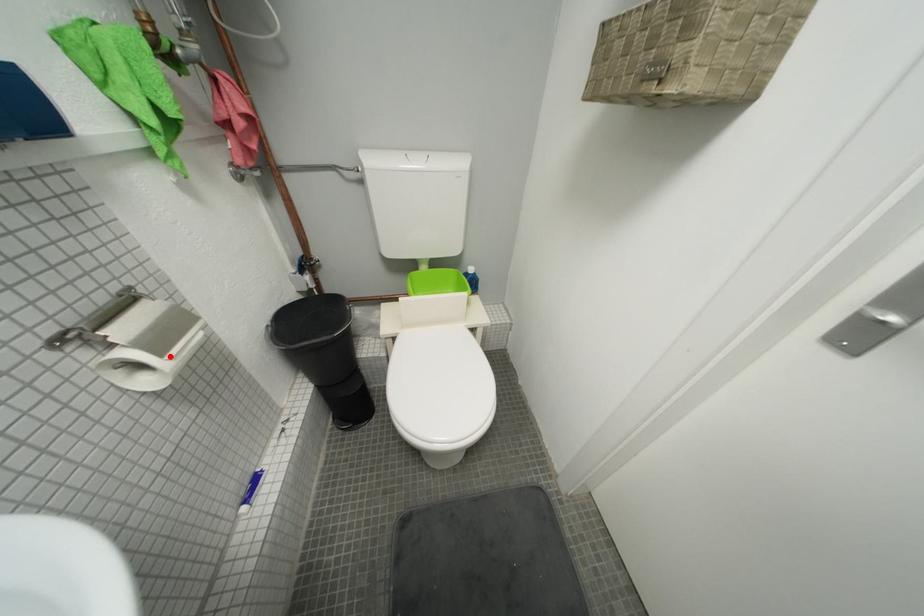
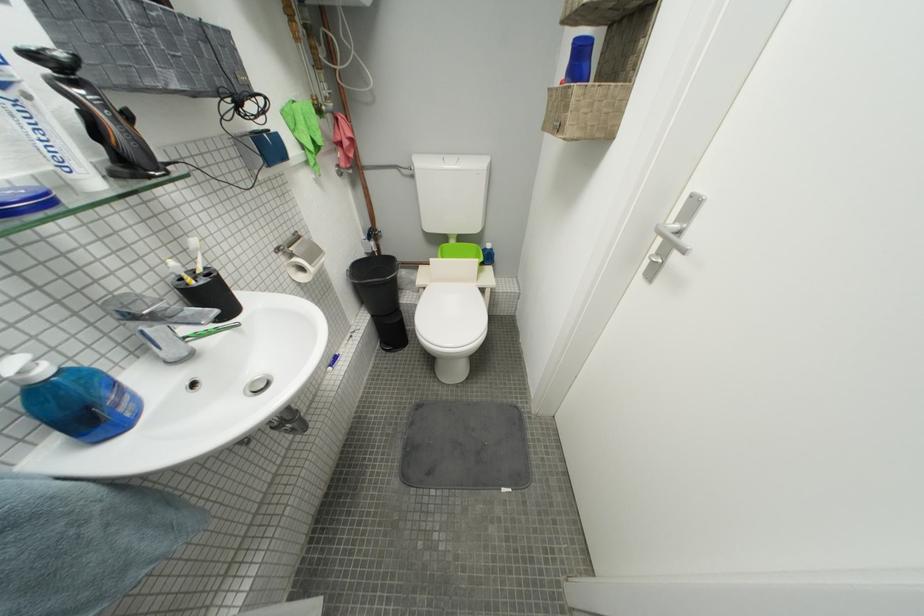
Question: I am providing you with two images of the same scene from different viewpoints. Image1 has a red point marked. In image2, the corresponding 3D location appears at what relative position? Reply with the corresponding letter.

Choices:
 (A) Closer
 (B) Farther

Answer: (A)